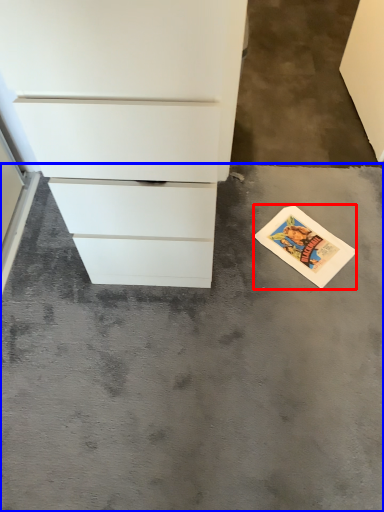
Question: Which of the following is the farthest to the observer, postcard (highlighted by a red box) or concrete (highlighted by a blue box)?

Choices:
 (A) postcard
 (B) concrete

Answer: (A)